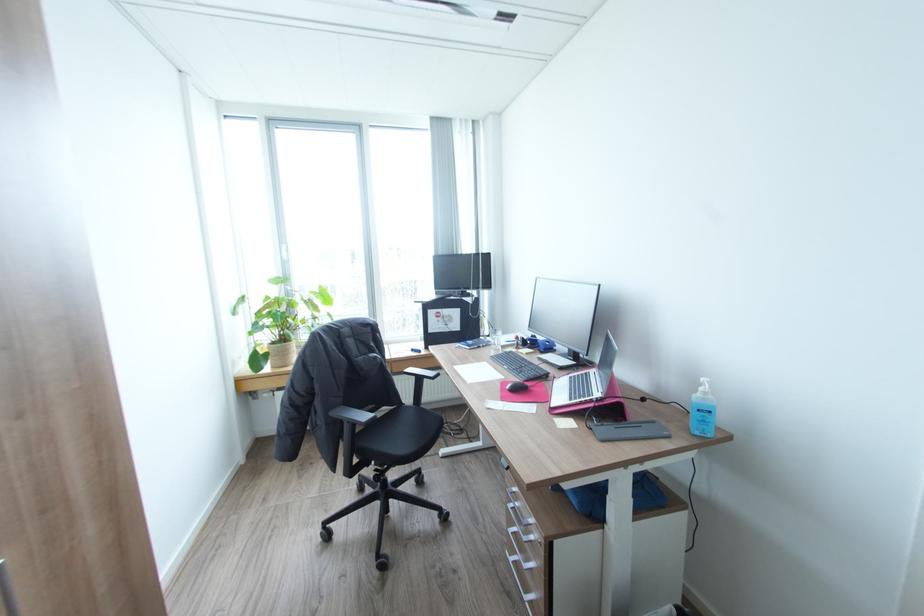
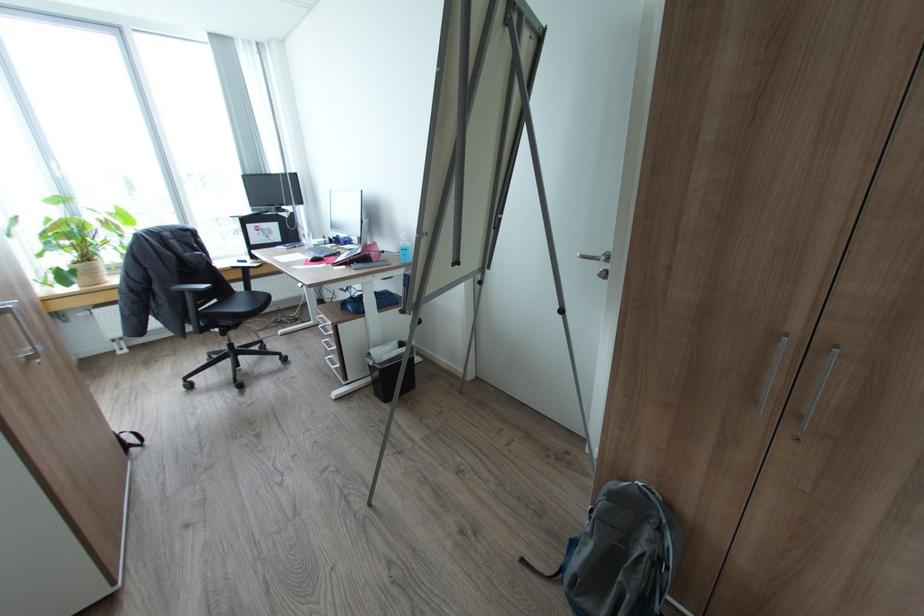
The point at [354,422] is marked in the first image. Where is the corresponding point in the second image?

(195, 292)